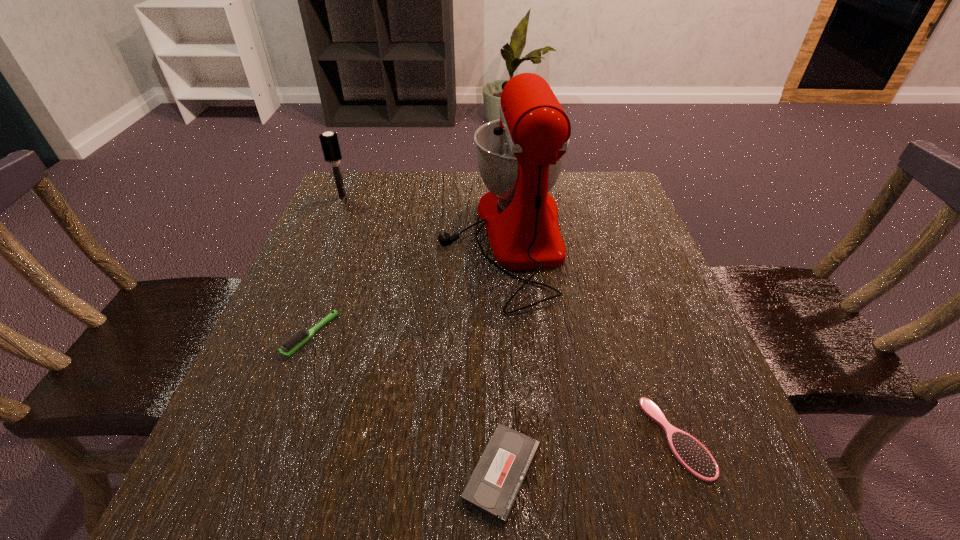
Identify the location of the tallest object. The width and height of the screenshot is (960, 540). pos(520,156).

This screenshot has width=960, height=540. Identify the location of the farthest hairbrush. (329, 141).

Identify the location of the second tallest object. (329, 141).

Image resolution: width=960 pixels, height=540 pixels. In order to click on the second nearest hairbrush in this screenshot , I will do `click(293, 343)`.

The image size is (960, 540). I want to click on the second shortest hairbrush, so click(x=293, y=343).

This screenshot has width=960, height=540. Identify the location of the rightmost hairbrush. (693, 456).

This screenshot has width=960, height=540. I want to click on the nearest hairbrush, so click(x=693, y=456).

What are the coordinates of `the shortest object` in the screenshot? It's located at (494, 485).

Where is `vacant space situated 0.220m on the bowl side of the mixer`? The height and width of the screenshot is (540, 960). vacant space situated 0.220m on the bowl side of the mixer is located at coordinates (345, 238).

At what (x,y) coordinates should I click in order to perform the action: click on free space located on the bowl side of the mixer. Please return your answer as a coordinate pair (x, y). Looking at the image, I should click on (345, 238).